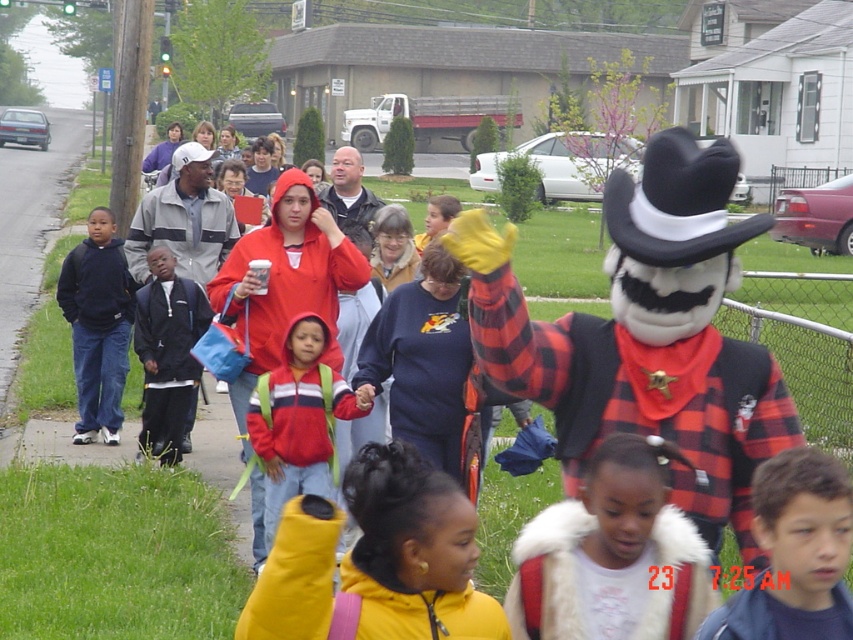
Question: From the image, what is the correct spatial relationship of black felt cowboy hat at right in relation to dark blue jacket at left?

Choices:
 (A) right
 (B) left

Answer: (A)

Question: Based on their relative distances, which object is farther from the matte black jacket at left?

Choices:
 (A) dark blue jacket at left
 (B) red fleece jacket at center

Answer: (B)

Question: Which object is farther from the camera taking this photo?

Choices:
 (A) white fur coat at lower center
 (B) matte black hoodie at left
 (C) dark blue jacket at left

Answer: (B)

Question: From the image, what is the correct spatial relationship of blue denim jacket at lower right in relation to yellow fuzzy glove at lower center?

Choices:
 (A) right
 (B) left

Answer: (A)

Question: Which of these objects is positioned closest to the black felt cowboy hat at upper center?

Choices:
 (A) red fleece jacket at center
 (B) white fur coat at lower center

Answer: (B)

Question: Does yellow fuzzy glove at lower center have a greater width compared to black felt cowboy hat at upper center?

Choices:
 (A) yes
 (B) no

Answer: (A)